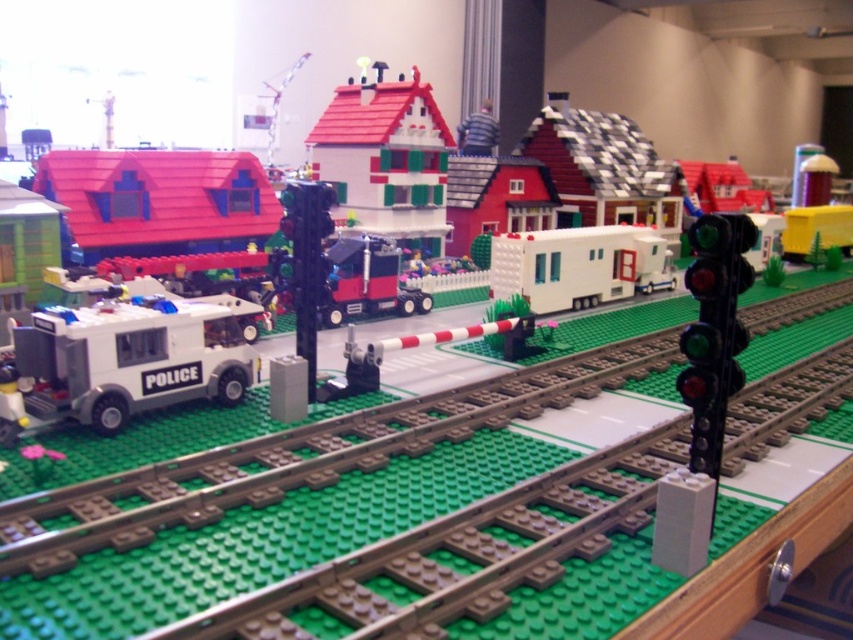
Does matte plastic house at upper left have a greater width compared to smooth white house at center?

Yes, matte plastic house at upper left is wider than smooth white house at center.

Does matte plastic house at upper left have a lesser width compared to smooth white house at center?

No, matte plastic house at upper left is not thinner than smooth white house at center.

Image resolution: width=853 pixels, height=640 pixels. I want to click on matte plastic house at upper left, so click(x=160, y=200).

Does brown textured train track at center have a lesser height compared to white matte police car at left?

No.

Between brown textured train track at center and white matte police car at left, which one appears on the left side from the viewer's perspective?

From the viewer's perspective, white matte police car at left appears more on the left side.

Image resolution: width=853 pixels, height=640 pixels. I want to click on brown textured train track at center, so tap(323, 509).

Between brown textured train track at center and smooth white house at center, which one appears on the left side from the viewer's perspective?

smooth white house at center is more to the left.

Find the location of a particular element. This screenshot has height=640, width=853. brown textured train track at center is located at coordinates (323, 509).